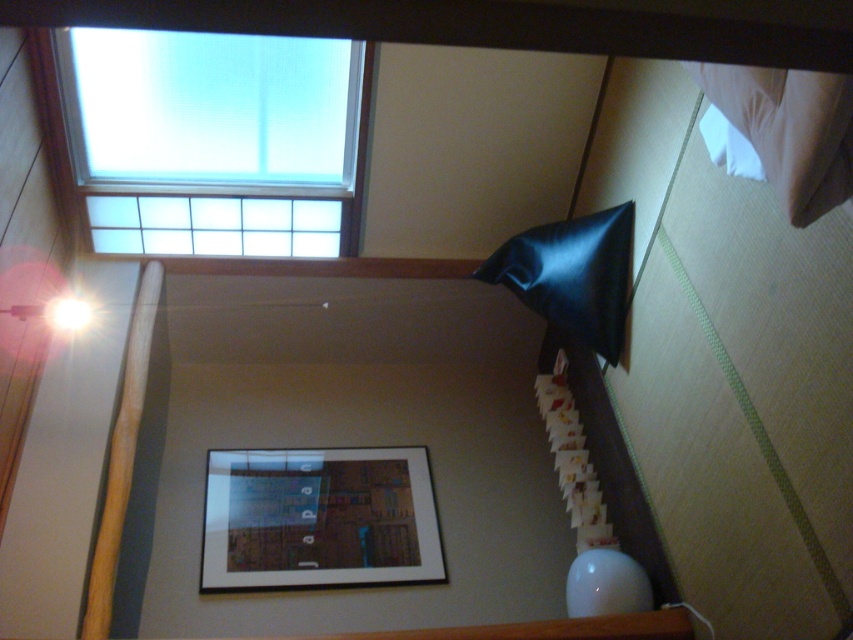
You are decorating a room and want to place a small plant between the black leather pillow at upper right and the wooden beam at left. Based on their heights, which object should the plant be placed closer to?

The black leather pillow at upper right is not as tall as the wooden beam at left, so the plant should be placed closer to the wooden beam at left to maintain balance in height.

You are an interior designer assessing a room with a skylight and artwork. You notice a black leather pillow at upper right and a white paper at center. Which object takes up more space in the visual field?

The black leather pillow at upper right is bigger than the white paper at center, so it takes up more space in the visual field.